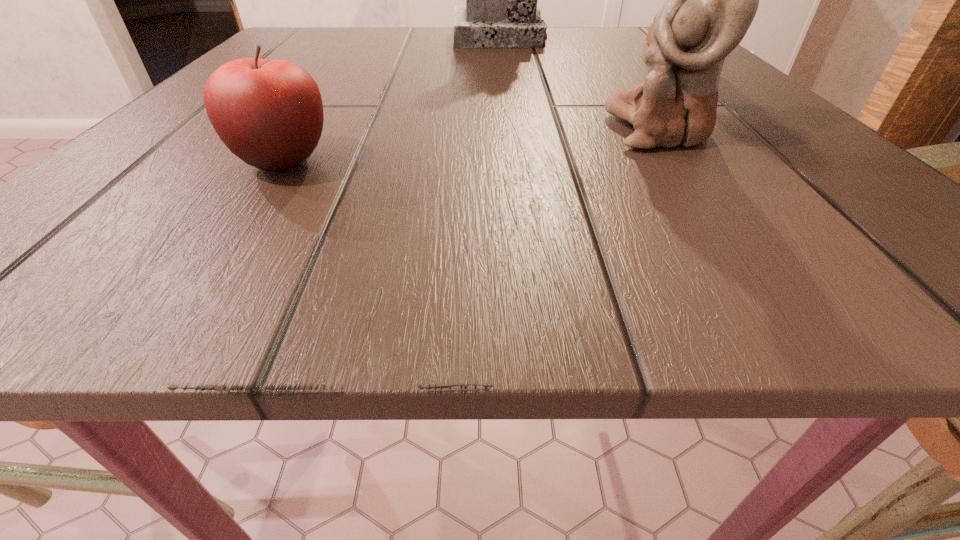
Locate an element on the screen. the rightmost figurine is located at coordinates (649, 35).

Find the location of a particular element. The image size is (960, 540). the third object from right to left is located at coordinates (501, 11).

Where is `the second figurine from left to right`? The image size is (960, 540). the second figurine from left to right is located at coordinates tap(711, 0).

This screenshot has height=540, width=960. I want to click on the second object from right to left, so click(x=711, y=0).

At what (x,y) coordinates should I click in order to perform the action: click on the shortest object. Please return your answer as a coordinate pair (x, y). Looking at the image, I should click on (269, 113).

Identify the location of the leftmost object. This screenshot has height=540, width=960. (269, 113).

At what (x,y) coordinates should I click in order to perform the action: click on free space located 0.120m on the front-facing side of the rightmost figurine. Please return your answer as a coordinate pair (x, y). Looking at the image, I should click on (579, 49).

Where is `free spot located on the front-facing side of the rightmost figurine`? The width and height of the screenshot is (960, 540). free spot located on the front-facing side of the rightmost figurine is located at coordinates (514, 49).

You are a GUI agent. You are given a task and a screenshot of the screen. Output one action in this format:
    pyautogui.click(x=<x>, y=<y>)
    Task: Click on the vacant region located on the front-facing side of the rightmost figurine
    Image resolution: width=960 pixels, height=540 pixels.
    Given the screenshot: What is the action you would take?
    pyautogui.click(x=595, y=49)

This screenshot has width=960, height=540. I want to click on vacant space situated 0.310m on the front-facing side of the leftmost figurine, so click(x=510, y=115).